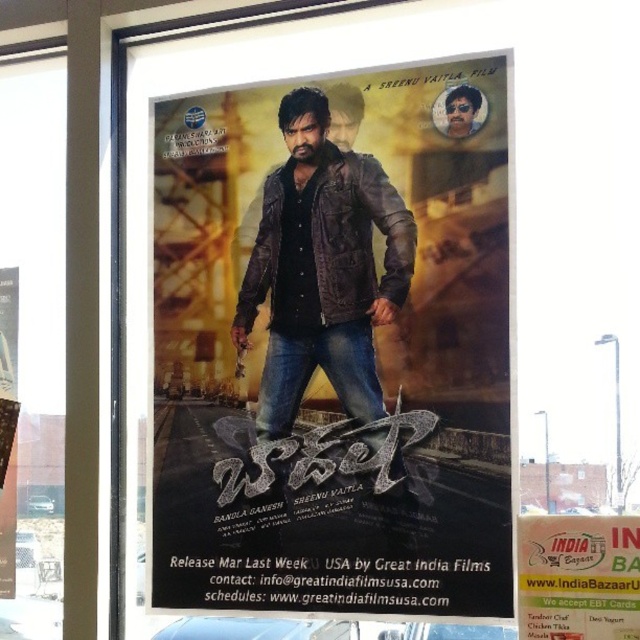
You are a graphic designer reviewing this movie poster. You need to ensure that the white paper sign at lower right is not too small compared to the leather jacket at center. Based on the image, what can you conclude about their sizes?

The leather jacket at center is larger in size than the white paper sign at lower right, so the white paper sign at lower right is smaller than the leather jacket at center and may need to be adjusted for better visibility.

You are a photographer trying to capture the movie poster in the scene. You need to ensure that both the brown leather jacket at center and the white paper sign at lower right are clearly visible in your photo. Given their sizes, which object should you focus on first to ensure both are in frame?

The brown leather jacket at center is larger than the white paper sign at lower right. To ensure both are in frame, focus on positioning the camera so the larger brown leather jacket at center is centered, then adjust to include the smaller white paper sign at lower right.